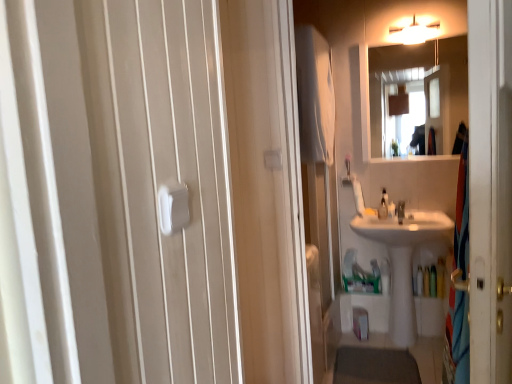
The image size is (512, 384). Find the location of `vacant area situated to the left side of translucent plastic soap dispenser at center`. vacant area situated to the left side of translucent plastic soap dispenser at center is located at coordinates (365, 222).